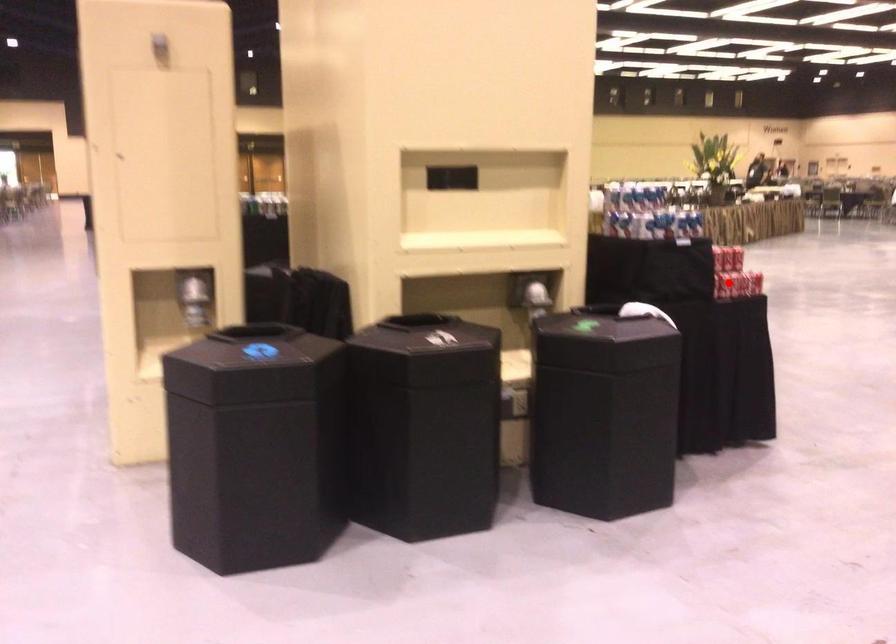
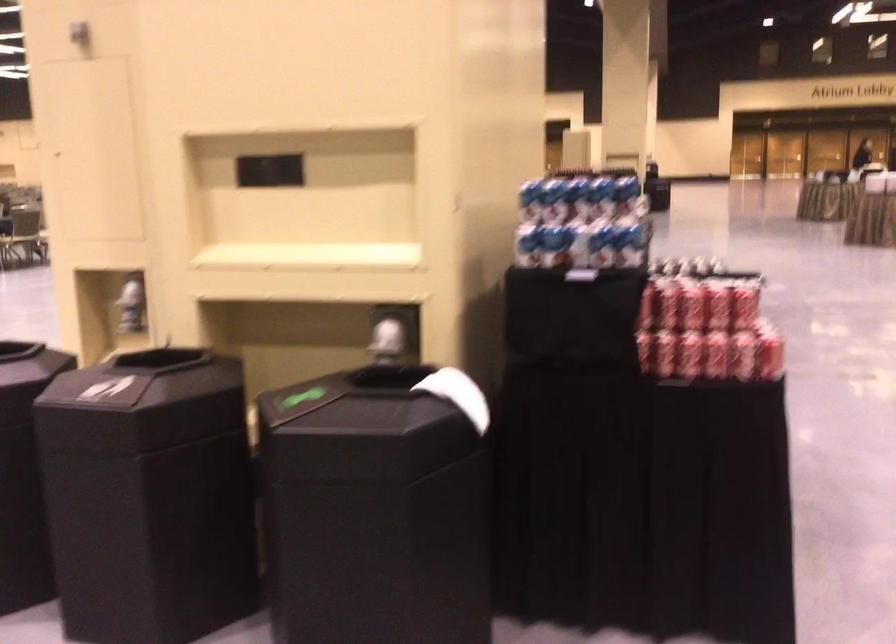
Question: A red point is marked in image1. In image2, is the corresponding 3D point closer to the camera or farther? Reply with the corresponding letter.

Choices:
 (A) The corresponding 3D point is closer.
 (B) The corresponding 3D point is farther.

Answer: (A)